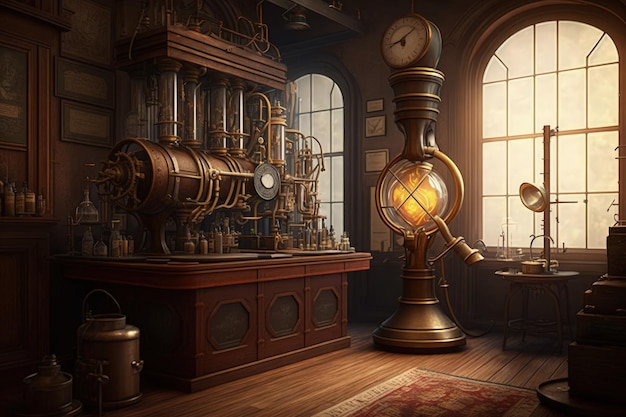
Locate an element on the screen. This screenshot has height=417, width=626. framed wall hanging is located at coordinates (89, 130), (89, 80), (86, 35), (375, 100), (380, 129), (367, 158), (377, 232).